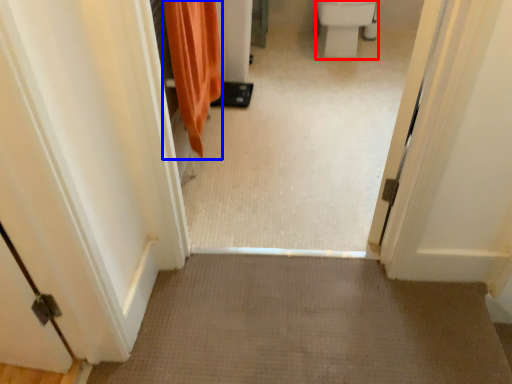
Question: Which object is closer to the camera taking this photo, toilet bowl (highlighted by a red box) or shower curtain (highlighted by a blue box)?

Choices:
 (A) toilet bowl
 (B) shower curtain

Answer: (B)